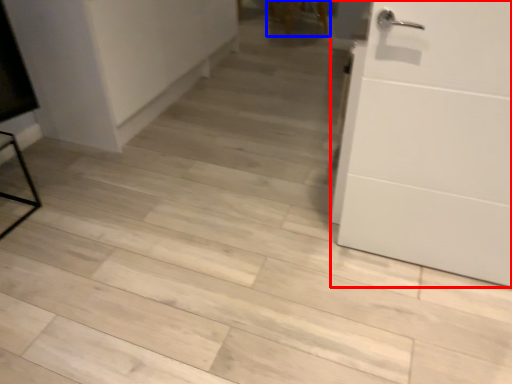
Question: Which object is further to the camera taking this photo, door (highlighted by a red box) or chair (highlighted by a blue box)?

Choices:
 (A) door
 (B) chair

Answer: (B)